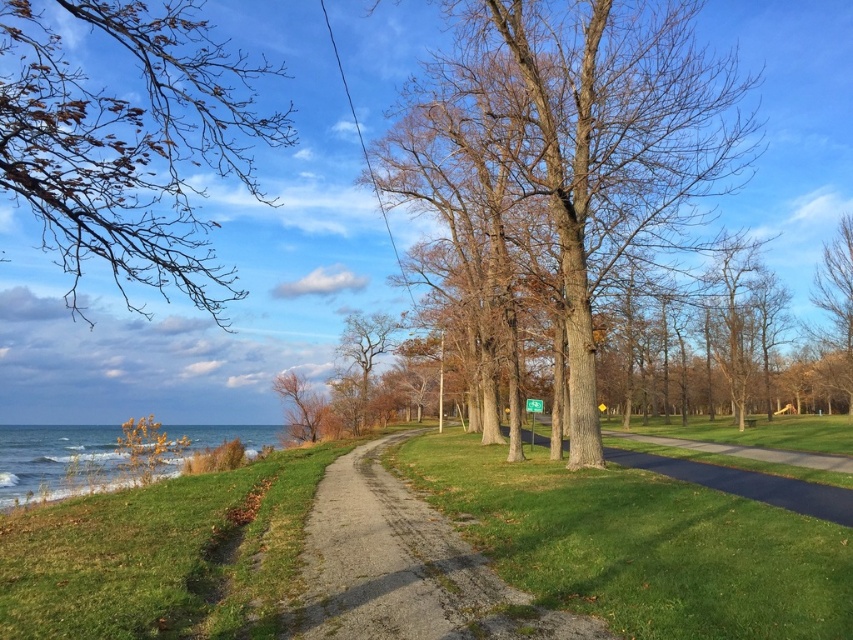
Which is in front, point (836, 522) or point (836, 285)?

Point (836, 522)

Can you confirm if dark gray asphalt path at center is smaller than brown textured tree at upper right?

Incorrect, dark gray asphalt path at center is not smaller in size than brown textured tree at upper right.

Between point (682, 461) and point (833, 346), which one is positioned in front?

Point (682, 461) is in front.

Locate an element on the screen. The image size is (853, 640). dark gray asphalt path at center is located at coordinates (746, 483).

Who is more distant from viewer, [80,481] or [347,328]?

Point [347,328]

Who is positioned more to the left, blue water at lower left or brown rough tree at center?

blue water at lower left is more to the left.

Does point (167, 436) come farther from viewer compared to point (363, 364)?

No, (167, 436) is closer to viewer.

Identify the location of blue water at lower left. Image resolution: width=853 pixels, height=640 pixels. (57, 460).

Who is lower down, brown rough bark tree at center or brown leafy branches at upper left?

brown rough bark tree at center

The image size is (853, 640). What do you see at coordinates (573, 148) in the screenshot? I see `brown rough bark tree at center` at bounding box center [573, 148].

Where is `brown rough bark tree at center`? This screenshot has height=640, width=853. brown rough bark tree at center is located at coordinates (573, 148).